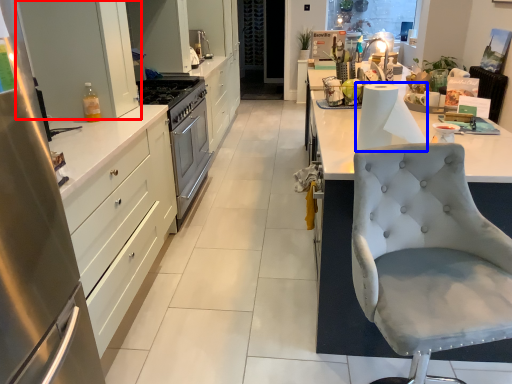
Question: Which object appears farthest to the camera in this image, cabinetry (highlighted by a red box) or paper towel (highlighted by a blue box)?

Choices:
 (A) cabinetry
 (B) paper towel

Answer: (A)